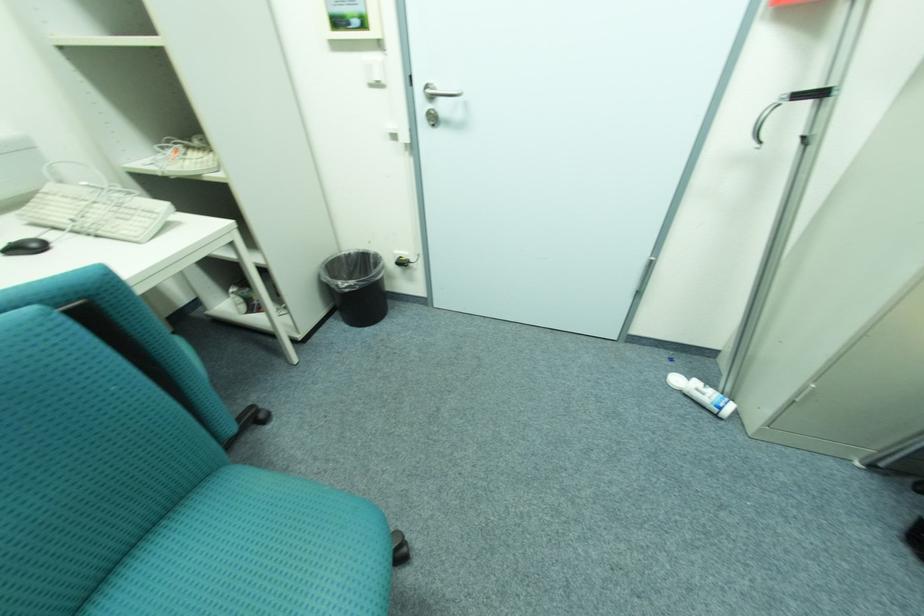
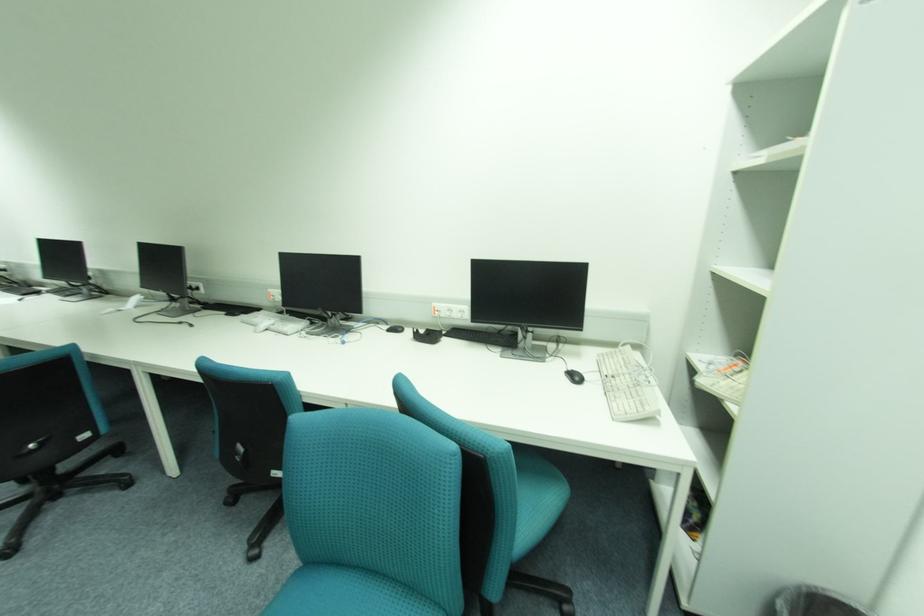
The point at (126, 217) is marked in the first image. Where is the corresponding point in the second image?

(631, 392)